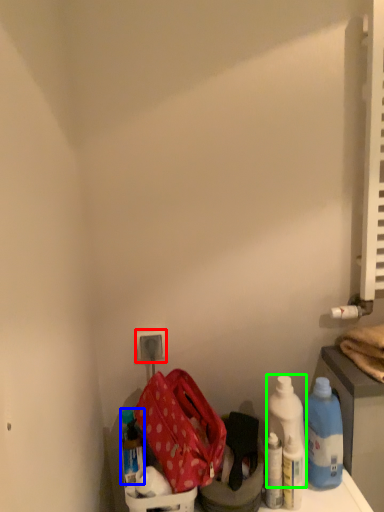
Question: Considering the real-world distances, which object is farthest from electric outlet (highlighted by a red box)? bottle (highlighted by a blue box) or cleaning product (highlighted by a green box)?

Choices:
 (A) bottle
 (B) cleaning product

Answer: (B)